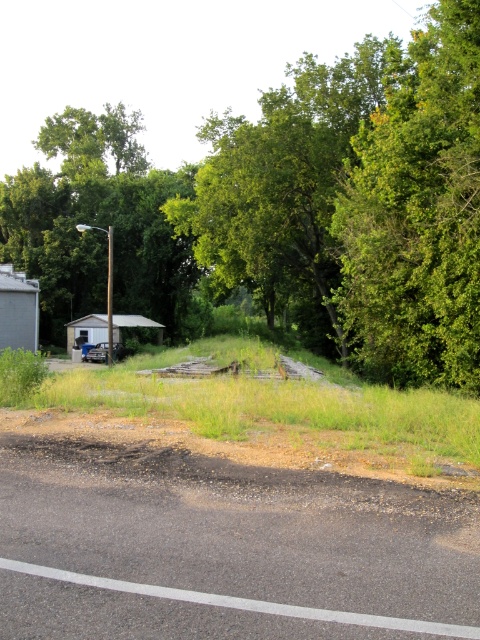
Is green leafy tree at upper right taller than rusty metal trailer at center?

Correct, green leafy tree at upper right is much taller as rusty metal trailer at center.

Is green leafy tree at upper right bigger than rusty metal trailer at center?

Indeed, green leafy tree at upper right has a larger size compared to rusty metal trailer at center.

Consider the image. Who is more distant from viewer, (459, 253) or (106, 353)?

The point (106, 353) is more distant.

In order to click on green leafy tree at upper right in this screenshot , I will do `click(417, 212)`.

Locate an element on the screen. green leafy tree at upper center is located at coordinates (301, 209).

Which is behind, point (435, 355) or point (111, 353)?

Point (111, 353)

Who is more distant from viewer, (382, 304) or (99, 349)?

Point (99, 349)

What are the coordinates of `green leafy tree at upper center` in the screenshot? It's located at (301, 209).

Can you confirm if green leafy tree at upper center is smaller than green leafy tree at upper right?

No, green leafy tree at upper center is not smaller than green leafy tree at upper right.

Which is behind, point (223, 243) or point (398, 348)?

Point (223, 243)

The width and height of the screenshot is (480, 640). I want to click on green leafy tree at upper center, so click(x=301, y=209).

Image resolution: width=480 pixels, height=640 pixels. Identify the location of green leafy tree at upper center. (301, 209).